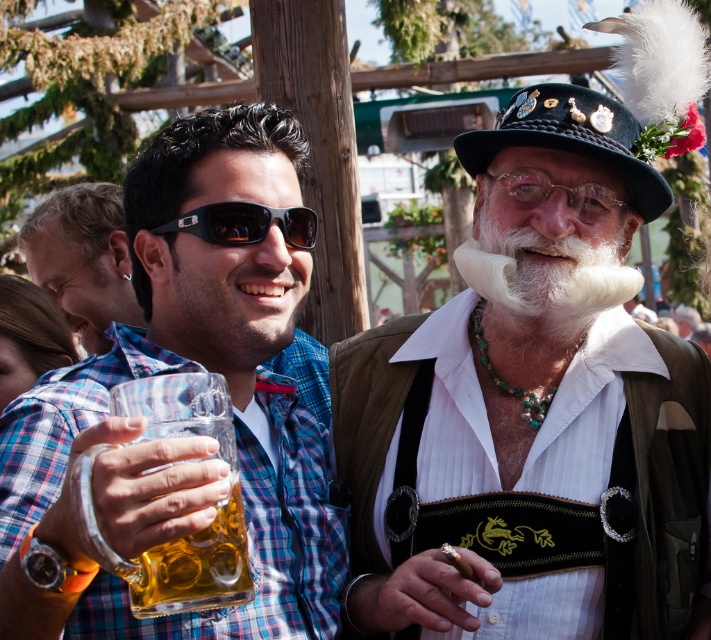
Is black felt hat at upper right wider than black matte sunglasses at center?

→ Correct, the width of black felt hat at upper right exceeds that of black matte sunglasses at center.

Between black felt hat at upper right and black matte sunglasses at center, which one appears on the right side from the viewer's perspective?

black felt hat at upper right

Is point (481, 154) less distant than point (228, 234)?

No, it is behind (228, 234).

The height and width of the screenshot is (640, 711). Identify the location of black felt hat at upper right. (572, 138).

Does brown fuzzy beard at center have a greater height compared to black matte sunglasses at center?

Yes.

In the scene shown: Can you confirm if brown fuzzy beard at center is positioned to the right of black matte sunglasses at center?

In fact, brown fuzzy beard at center is to the left of black matte sunglasses at center.

This screenshot has width=711, height=640. What do you see at coordinates (228, 301) in the screenshot?
I see `brown fuzzy beard at center` at bounding box center [228, 301].

The height and width of the screenshot is (640, 711). In order to click on brown fuzzy beard at center in this screenshot , I will do `click(228, 301)`.

Which of these two, matte black shirt at upper left or black matte sunglasses at center, stands taller?

matte black shirt at upper left

Looking at this image, which is more to the right, matte black shirt at upper left or black matte sunglasses at center?

black matte sunglasses at center is more to the right.

Who is more distant from viewer, (117, 252) or (178, 227)?

The point (117, 252) is behind.

Find the location of a particular element. The width and height of the screenshot is (711, 640). matte black shirt at upper left is located at coordinates (82, 259).